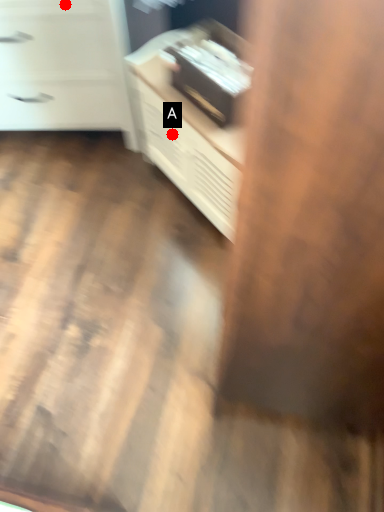
Question: Two points are circled on the image, labeled by A and B beside each circle. Which point is farther from the camera taking this photo?

Choices:
 (A) A is further
 (B) B is further

Answer: (A)